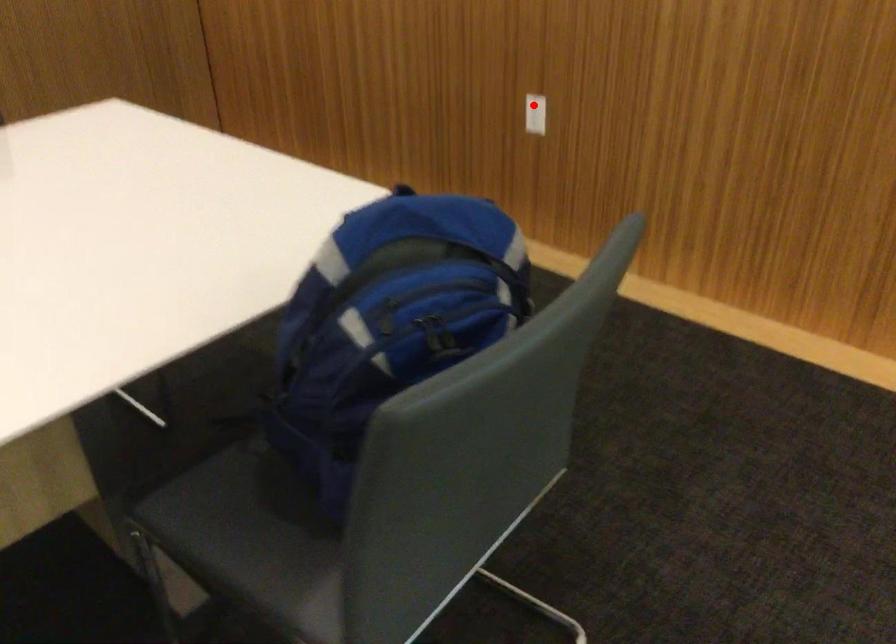
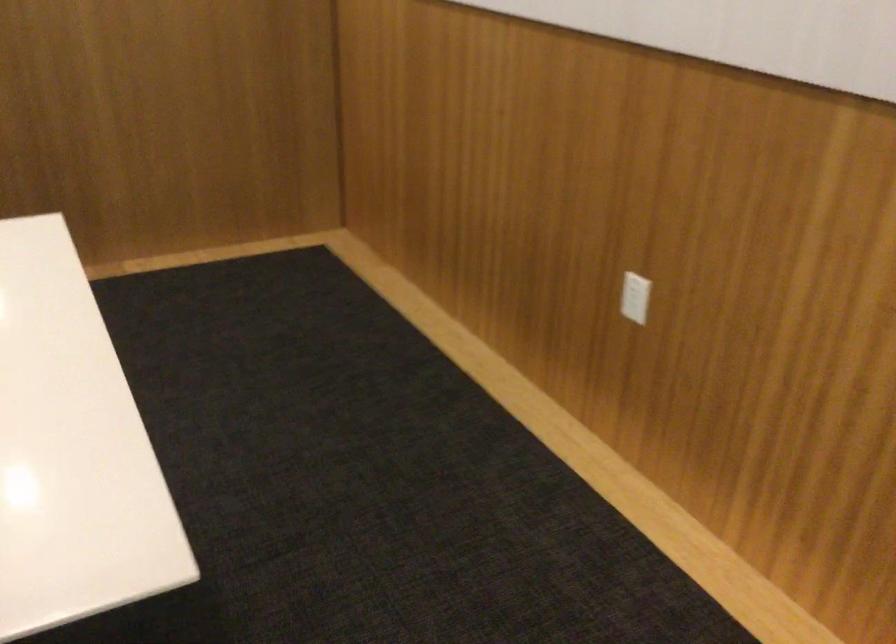
The point at the highlighted location is marked in the first image. Where is the corresponding point in the second image?

(634, 297)